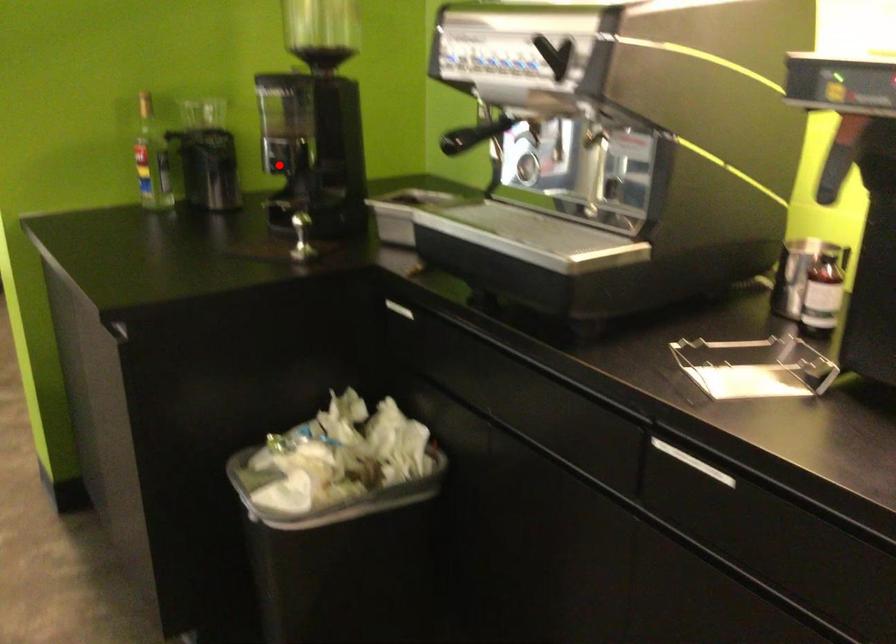
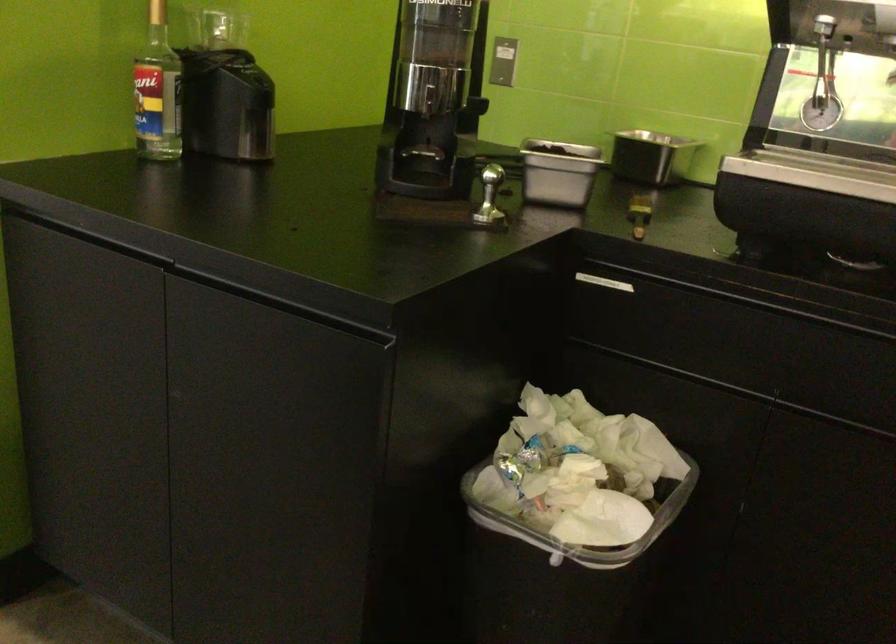
Question: I am providing you with two images of the same scene from different viewpoints. Image1 has a red point marked. In image2, the corresponding 3D location appears at what relative position? Reply with the corresponding letter.

Choices:
 (A) Closer
 (B) Farther

Answer: (A)